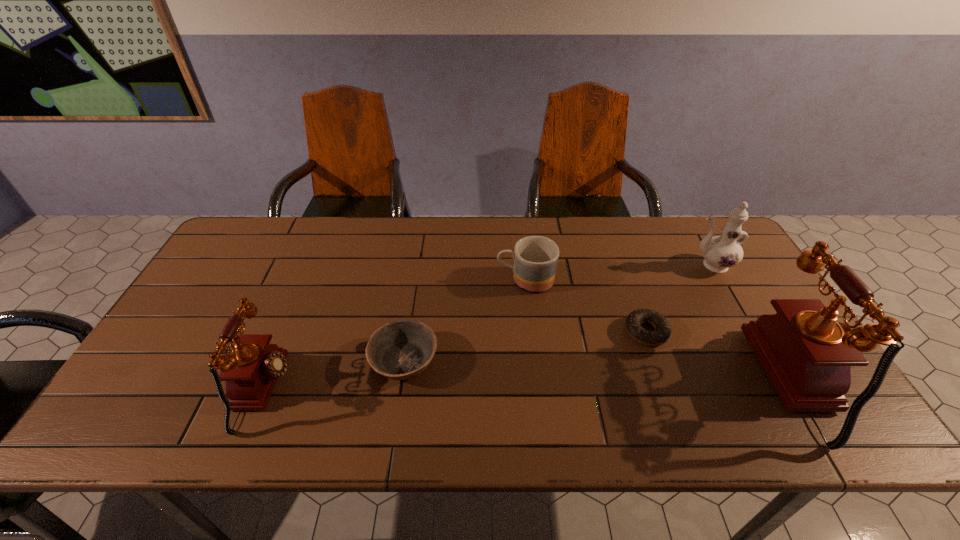
Where is `bowl`? The width and height of the screenshot is (960, 540). bowl is located at coordinates (399, 350).

The height and width of the screenshot is (540, 960). Find the location of `vacant region located on the dial of the left telephone`. vacant region located on the dial of the left telephone is located at coordinates click(x=449, y=390).

Locate an element on the screen. vacant region located at the spout of the chinaware is located at coordinates (645, 265).

You are a GUI agent. You are given a task and a screenshot of the screen. Output one action in this format:
    pyautogui.click(x=<x>, y=<y>)
    Task: Click on the free space located at the spout of the chinaware
    The width and height of the screenshot is (960, 540).
    Given the screenshot: What is the action you would take?
    pyautogui.click(x=638, y=265)

You are a GUI agent. You are given a task and a screenshot of the screen. Output one action in this format:
    pyautogui.click(x=<x>, y=<y>)
    Task: Click on the vacant space located 0.240m at the spout of the chinaware
    The width and height of the screenshot is (960, 540).
    Given the screenshot: What is the action you would take?
    pyautogui.click(x=610, y=265)

Find the location of a particular element. This screenshot has width=960, height=540. vacant space situated 0.270m on the back of the doughnut is located at coordinates (618, 253).

What are the coordinates of `free space located on the side with the handle of the third object from left to right` in the screenshot? It's located at (383, 280).

Image resolution: width=960 pixels, height=540 pixels. Find the location of `blank area located 0.380m on the side with the handle of the third object from left to right`. blank area located 0.380m on the side with the handle of the third object from left to right is located at coordinates (370, 280).

Identify the location of vacant space located on the side with the handle of the third object from left to right. (443, 280).

This screenshot has height=540, width=960. In order to click on vacant space located 0.160m on the right of the second shortest object in this screenshot , I will do `click(502, 361)`.